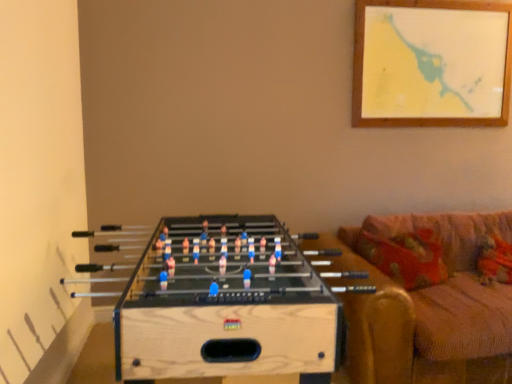
The width and height of the screenshot is (512, 384). I want to click on velvet orange couch at right, so click(x=430, y=310).

The height and width of the screenshot is (384, 512). What do you see at coordinates (430, 310) in the screenshot? I see `velvet orange couch at right` at bounding box center [430, 310].

What is the approximate width of natural wood foosball table at lower left?

The width of natural wood foosball table at lower left is 3.93 feet.

This screenshot has height=384, width=512. I want to click on natural wood foosball table at lower left, so click(257, 311).

The image size is (512, 384). What do you see at coordinates (257, 311) in the screenshot?
I see `natural wood foosball table at lower left` at bounding box center [257, 311].

At what (x,y) coordinates should I click in order to perform the action: click on velvet orange couch at right. Please return your answer as a coordinate pair (x, y). Looking at the image, I should click on (430, 310).

Is natural wood foosball table at lower left at the left side of velvet orange couch at right?

Correct, you'll find natural wood foosball table at lower left to the left of velvet orange couch at right.

In the scene shown: Is the depth of natural wood foosball table at lower left greater than that of velvet orange couch at right?

No, the depth of natural wood foosball table at lower left is less than that of velvet orange couch at right.

Which is farther, (323, 277) or (459, 250)?

The point (459, 250) is more distant.

From the image's perspective, is natural wood foosball table at lower left on velvet orange couch at right?

No, from the image's perspective, natural wood foosball table at lower left is not on top of velvet orange couch at right.

From a real-world perspective, is natural wood foosball table at lower left physically below velvet orange couch at right?

Incorrect, from a real-world perspective, natural wood foosball table at lower left is higher than velvet orange couch at right.

Considering the sizes of objects natural wood foosball table at lower left and velvet orange couch at right in the image provided, who is wider, natural wood foosball table at lower left or velvet orange couch at right?

Wider between the two is velvet orange couch at right.

Is natural wood foosball table at lower left taller or shorter than velvet orange couch at right?

Considering their sizes, natural wood foosball table at lower left has more height than velvet orange couch at right.

Which of these two, natural wood foosball table at lower left or velvet orange couch at right, is bigger?

velvet orange couch at right is bigger.

Is natural wood foosball table at lower left not inside velvet orange couch at right?

Yes, natural wood foosball table at lower left is outside of velvet orange couch at right.

Is there a large distance between natural wood foosball table at lower left and velvet orange couch at right?

No, natural wood foosball table at lower left is not far away from velvet orange couch at right.

Does natural wood foosball table at lower left turn towards velvet orange couch at right?

Yes, natural wood foosball table at lower left is facing velvet orange couch at right.

Image resolution: width=512 pixels, height=384 pixels. I want to click on table positioned vertically above the velvet orange couch at right (from a real-world perspective), so coord(257,311).

Does velvet orange couch at right appear on the right side of natural wood foosball table at lower left?

Yes.

In the scene shown: Relative to natural wood foosball table at lower left, is velvet orange couch at right in front or behind?

velvet orange couch at right is behind natural wood foosball table at lower left.

Does point (413, 303) come farther from viewer compared to point (187, 278)?

Yes, point (413, 303) is behind point (187, 278).

From the image's perspective, is velvet orange couch at right over natural wood foosball table at lower left?

Yes, from the image's perspective, velvet orange couch at right is above natural wood foosball table at lower left.

From a real-world perspective, is velvet orange couch at right located higher than natural wood foosball table at lower left?

No, from a real-world perspective, velvet orange couch at right is not above natural wood foosball table at lower left.

Considering the sizes of objects velvet orange couch at right and natural wood foosball table at lower left in the image provided, who is thinner, velvet orange couch at right or natural wood foosball table at lower left?

natural wood foosball table at lower left is thinner.

Between velvet orange couch at right and natural wood foosball table at lower left, which one has more height?

With more height is natural wood foosball table at lower left.

Between velvet orange couch at right and natural wood foosball table at lower left, which one has larger size?

velvet orange couch at right.

Is natural wood foosball table at lower left completely or partially inside velvet orange couch at right?

No.

Can you see velvet orange couch at right touching natural wood foosball table at lower left?

There is a gap between velvet orange couch at right and natural wood foosball table at lower left.

Does velvet orange couch at right turn towards natural wood foosball table at lower left?

No, velvet orange couch at right is not turned towards natural wood foosball table at lower left.

Locate an element on the screen. This screenshot has height=384, width=512. studio couch below the natural wood foosball table at lower left (from a real-world perspective) is located at coordinates (430, 310).

At what (x,y) coordinates should I click in order to perform the action: click on table on the left of velvet orange couch at right. Please return your answer as a coordinate pair (x, y). This screenshot has height=384, width=512. Looking at the image, I should click on (257, 311).

Where is `studio couch above the natural wood foosball table at lower left (from the image's perspective)`? The width and height of the screenshot is (512, 384). studio couch above the natural wood foosball table at lower left (from the image's perspective) is located at coordinates (430, 310).